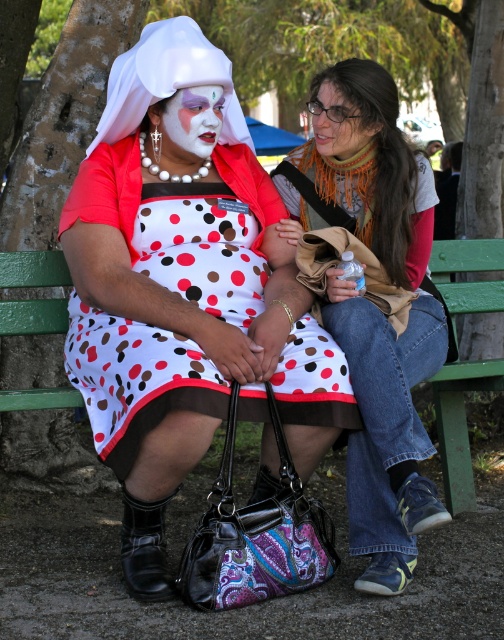
I want to click on polka dot dress at center, so click(x=184, y=294).

Between point (193, 400) and point (332, 141), which one is positioned behind?

Point (332, 141)

Is point (163, 282) farther from camera compared to point (346, 124)?

No, (163, 282) is in front of (346, 124).

This screenshot has width=504, height=640. What are the coordinates of `polka dot dress at center` in the screenshot? It's located at (184, 294).

Does denim jeans at center appear under green painted wood bench at center?

No.

Is point (383, 205) farther from camera compared to point (10, 268)?

No, it is in front of (10, 268).

Image resolution: width=504 pixels, height=640 pixels. What do you see at coordinates (387, 429) in the screenshot?
I see `denim jeans at center` at bounding box center [387, 429].

Identify the location of denim jeans at center. The image size is (504, 640). (387, 429).

Which is below, denim jeans at center or white matte face paint at center?

Positioned lower is denim jeans at center.

Does denim jeans at center have a lesser height compared to white matte face paint at center?

Incorrect, denim jeans at center's height does not fall short of white matte face paint at center's.

The image size is (504, 640). What do you see at coordinates (387, 429) in the screenshot?
I see `denim jeans at center` at bounding box center [387, 429].

The width and height of the screenshot is (504, 640). I want to click on denim jeans at center, so click(387, 429).